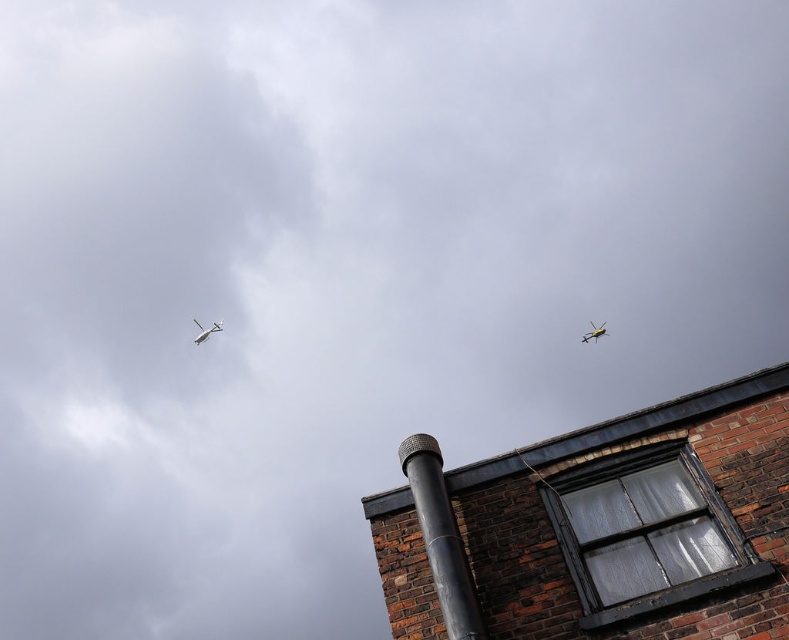
You are a pilot flying a third airplane that needs to land at the airport. You see the white glossy airplane at upper left and the metallic yellow airplane at upper right in the sky. Which airplane is higher in the sky?

The white glossy airplane at upper left is higher in the sky compared to the metallic yellow airplane at upper right as per the given description.

From the picture: You are a pilot flying a small drone that needs to navigate between the smooth brick chimney at upper right and the white glossy airplane at upper left. Based on their positions, which direction should the drone turn to avoid collision?

The smooth brick chimney at upper right is to the right of the white glossy airplane at upper left, so the drone should turn to the left to avoid collision.